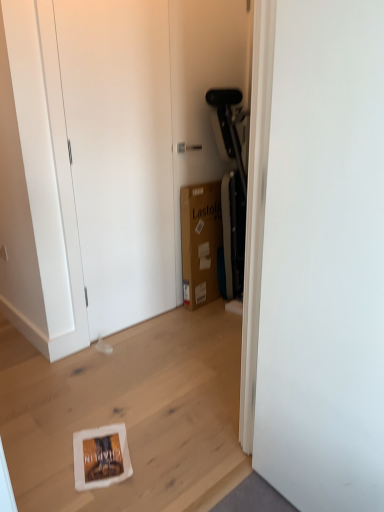
Question: From a real-world perspective, relative to white matte door at center, acting as the 1th door starting from the right, is brown cardboard box at center vertically above or below?

Choices:
 (A) above
 (B) below

Answer: (B)

Question: Would you say brown cardboard box at center is to the left or to the right of white matte door at center, positioned as the 2th door in left-to-right order, in the picture?

Choices:
 (A) left
 (B) right

Answer: (A)

Question: Which is nearer to the white matte door at upper left, the first door viewed from the left?

Choices:
 (A) white matte door at center, marked as the 1th door in a front-to-back arrangement
 (B) brown cardboard box at center
 (C) matte white dresser at center

Answer: (C)

Question: Estimate the real-world distances between objects in this image. Which object is farther from the white matte door at center, marked as the 1th door in a front-to-back arrangement?

Choices:
 (A) white matte door at upper left, the 1th door when ordered from back to front
 (B) matte white dresser at center
 (C) brown cardboard box at center

Answer: (C)